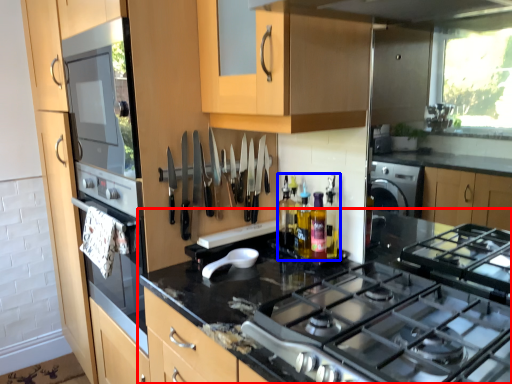
Question: Which object appears farthest to the camera in this image, countertop (highlighted by a red box) or bottle (highlighted by a blue box)?

Choices:
 (A) countertop
 (B) bottle

Answer: (B)